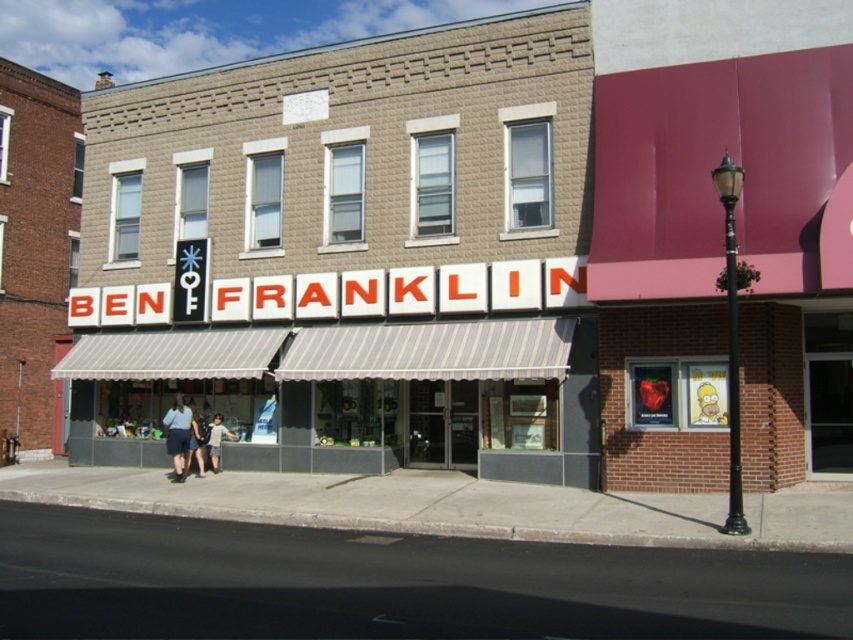
Question: Can you confirm if light blue denim shorts at center is positioned above denim shorts at center?

Choices:
 (A) yes
 (B) no

Answer: (A)

Question: Which point appears farthest from the camera in this image?

Choices:
 (A) (183, 461)
 (B) (189, 403)
 (C) (213, 456)

Answer: (B)

Question: In this image, where is light blue denim shorts at center located relative to denim shorts at center?

Choices:
 (A) above
 (B) below

Answer: (A)

Question: Based on their relative distances, which object is nearer to the light blue denim shorts at center?

Choices:
 (A) denim shorts at center
 (B) denim shorts at lower left

Answer: (B)

Question: Does denim shorts at lower left appear over denim shorts at center?

Choices:
 (A) yes
 (B) no

Answer: (A)

Question: Which of these objects is positioned farthest from the denim shorts at lower left?

Choices:
 (A) denim shorts at center
 (B) light blue denim shorts at center

Answer: (A)